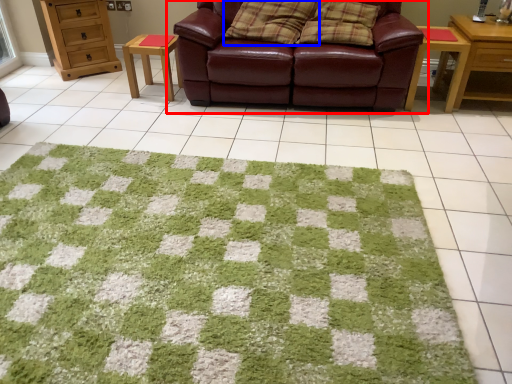
Question: Which of the following is the closest to the observer, studio couch (highlighted by a red box) or pillow (highlighted by a blue box)?

Choices:
 (A) studio couch
 (B) pillow

Answer: (A)